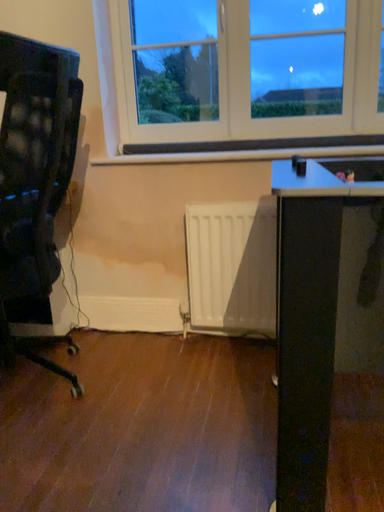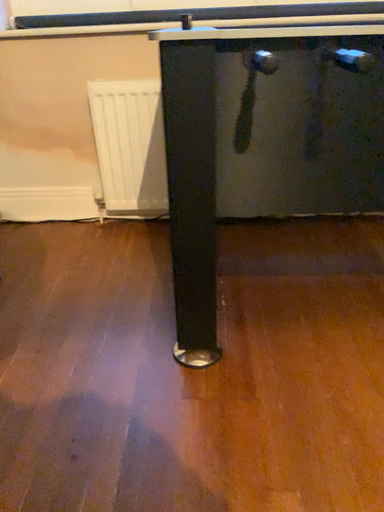
Question: How did the camera likely rotate when shooting the video?

Choices:
 (A) rotated upward
 (B) rotated downward

Answer: (B)